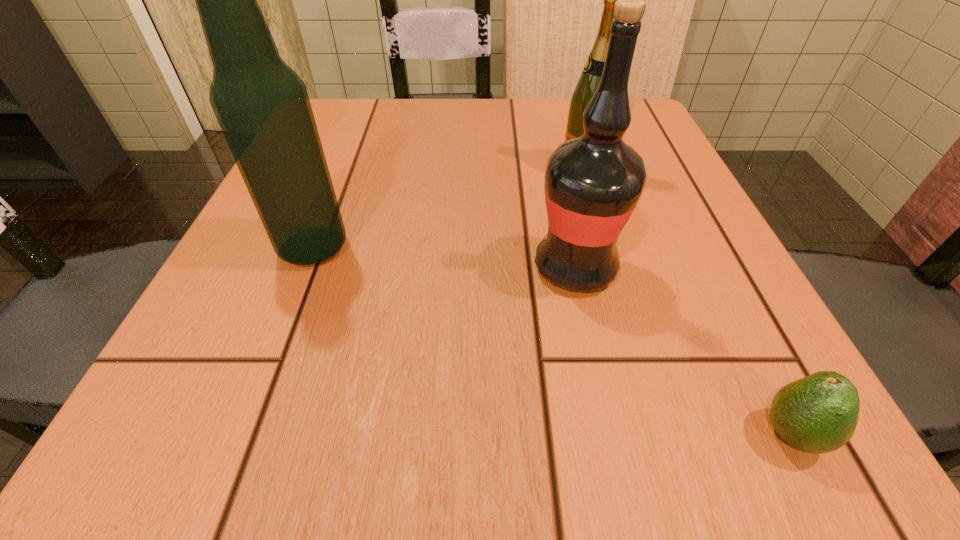
Where is `vacant area that lies between the nearest object and the leftmost object`? This screenshot has width=960, height=540. vacant area that lies between the nearest object and the leftmost object is located at coordinates (552, 341).

The height and width of the screenshot is (540, 960). What are the coordinates of `empty location between the alcohol and the nearer wine bottle` in the screenshot? It's located at coord(444,258).

Identify the location of empty space between the farther wine bottle and the avocado. Image resolution: width=960 pixels, height=540 pixels. (687, 301).

Identify the location of the closest object to the shortest object. The image size is (960, 540). (593, 182).

Where is `object that stands as the second closest to the rightmost object`? The width and height of the screenshot is (960, 540). object that stands as the second closest to the rightmost object is located at coordinates (589, 80).

Locate an element on the screen. blank area in the image that satisfies the following two spatial constraints: 1. on the front-facing side of the farthest object; 2. on the back side of the shortest object is located at coordinates (662, 434).

Image resolution: width=960 pixels, height=540 pixels. What are the coordinates of `vacant region that satisfies the following two spatial constraints: 1. on the front side of the rightmost object; 2. on the right side of the leftmost object` in the screenshot? It's located at (240, 434).

You are a GUI agent. You are given a task and a screenshot of the screen. Output one action in this format:
    pyautogui.click(x=<x>, y=<y>)
    Task: Click on the free spot that satisfies the following two spatial constraints: 1. on the front side of the nearer wine bottle; 2. on the right side of the nearest object
    
    Given the screenshot: What is the action you would take?
    pyautogui.click(x=611, y=434)

Locate an element on the screen. free space in the image that satisfies the following two spatial constraints: 1. on the front-facing side of the farther wine bottle; 2. on the front side of the tallest object is located at coordinates (607, 247).

Locate an element on the screen. The image size is (960, 540). free space in the image that satisfies the following two spatial constraints: 1. on the front-facing side of the farther wine bottle; 2. on the front side of the nearer wine bottle is located at coordinates (612, 267).